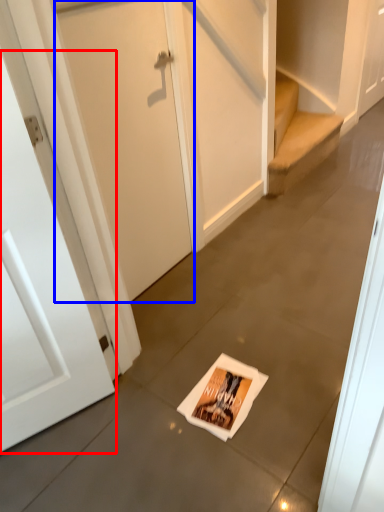
Question: Which point is closer to the camera, door (highlighted by a red box) or door (highlighted by a blue box)?

Choices:
 (A) door
 (B) door

Answer: (A)